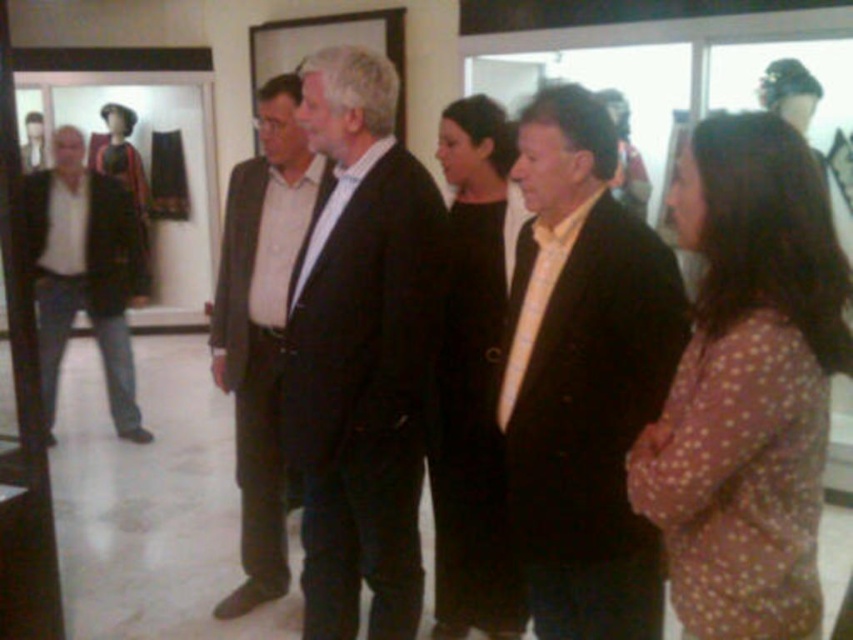
The width and height of the screenshot is (853, 640). Describe the element at coordinates (747, 385) in the screenshot. I see `brown dotted dress at lower right` at that location.

The height and width of the screenshot is (640, 853). I want to click on brown dotted dress at lower right, so click(x=747, y=385).

Can you confirm if matte black suit at center is positioned to the left of black matte coat at center?

Indeed, matte black suit at center is positioned on the left side of black matte coat at center.

Can you confirm if matte black suit at center is positioned below black matte coat at center?

Actually, matte black suit at center is above black matte coat at center.

Where is `matte black suit at center`? This screenshot has height=640, width=853. matte black suit at center is located at coordinates (363, 353).

The image size is (853, 640). Find the location of `matte black suit at center`. matte black suit at center is located at coordinates (363, 353).

Is matte black jacket at center shorter than dark brown suit at center?

Yes.

Who is shorter, matte black jacket at center or dark brown suit at center?

Standing shorter between the two is matte black jacket at center.

Does point (582, 352) come farther from viewer compared to point (231, 250)?

No, (582, 352) is in front of (231, 250).

Locate an element on the screen. matte black jacket at center is located at coordinates (x=583, y=376).